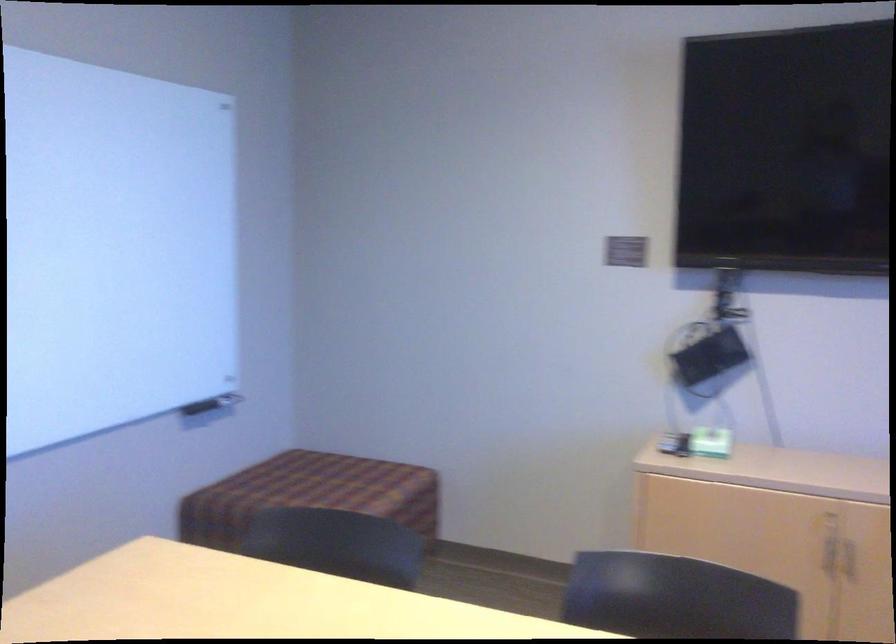
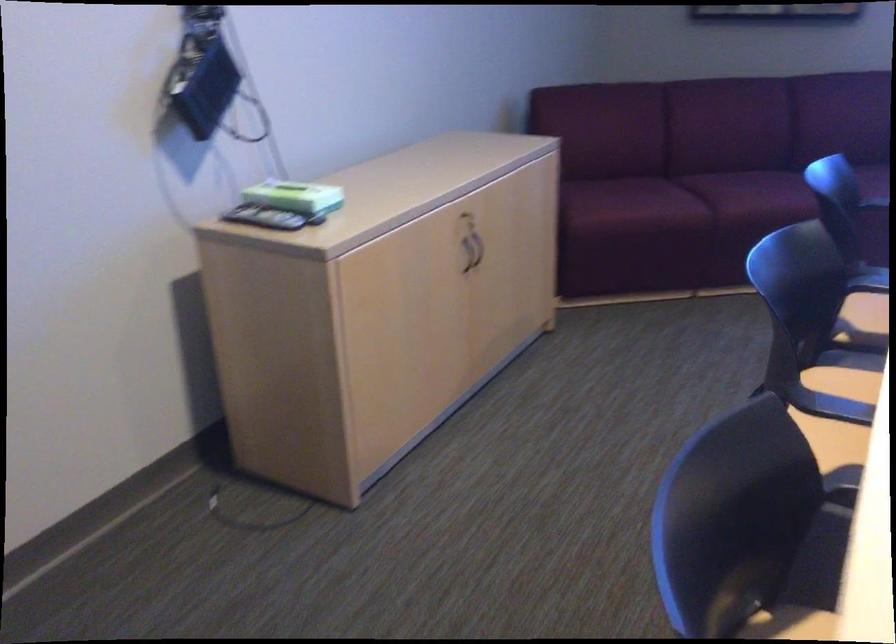
The point at (698, 436) is marked in the first image. Where is the corresponding point in the second image?

(287, 196)